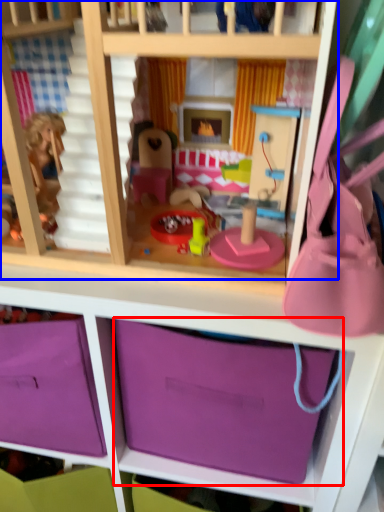
Question: Among these objects, which one is farthest to the camera, storage box (highlighted by a red box) or bunk bed (highlighted by a blue box)?

Choices:
 (A) storage box
 (B) bunk bed

Answer: (A)